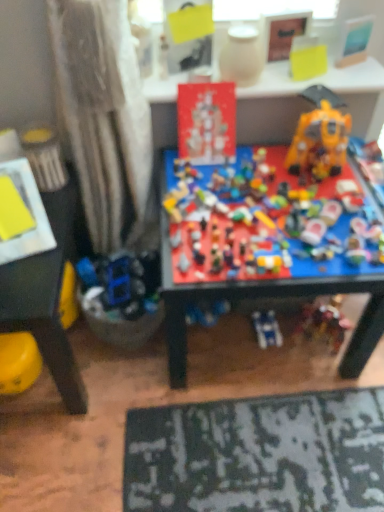
In order to click on vacant area that lies to the right of yellow plastic toy at lower left, which is the 2th table in right-to-left order in this screenshot , I will do `click(165, 398)`.